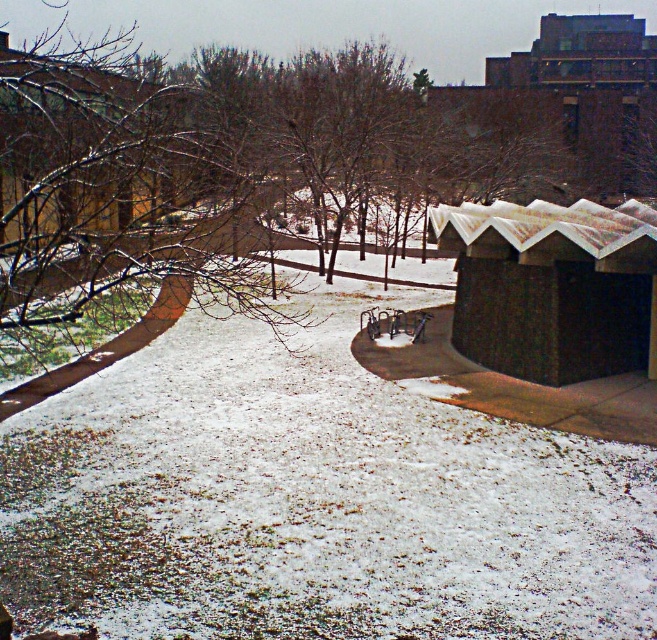
You are planning to take a photo of the winter scene. You want to include both the brown bare branches at upper left and the brown wooden hut at upper left in the frame. Which object should you position higher in your camera view to ensure both are visible?

To ensure both the brown bare branches at upper left and the brown wooden hut at upper left are visible, you should position the camera view so that the brown bare branches at upper left is higher since it is located above the brown wooden hut at upper left.

You are standing at the center of the snowy path in the winter scene. Looking towards the upper left corner of the image, can you see the brown bare branches at upper left? Please state their coordinates if visible.

Yes, the brown bare branches at upper left are visible and located at coordinates point (118, 202).